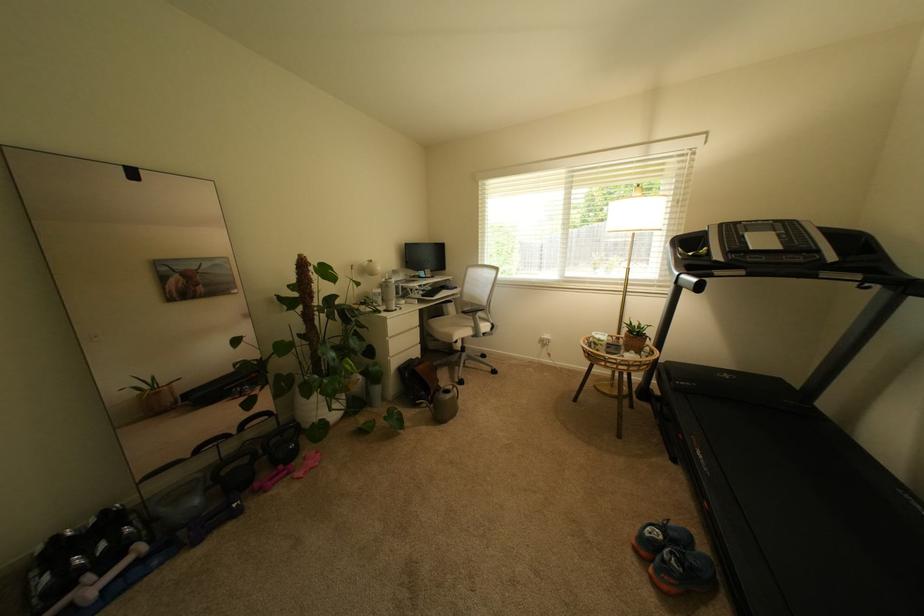
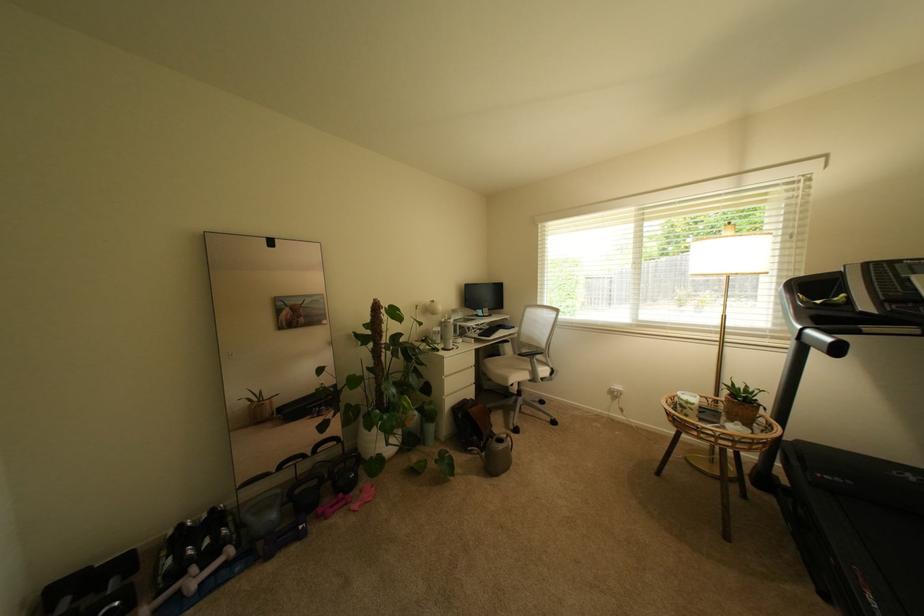
In the second image, find the point that corresponds to point (397, 361) in the first image.

(453, 400)